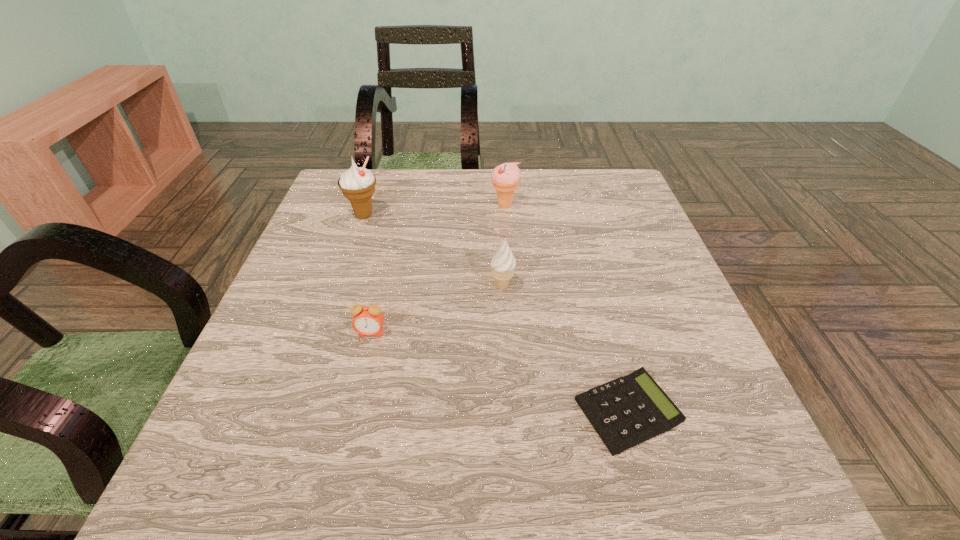
Where is `the tallest object`? The width and height of the screenshot is (960, 540). the tallest object is located at coordinates (357, 184).

The height and width of the screenshot is (540, 960). Find the location of `the leftmost object`. the leftmost object is located at coordinates (357, 184).

Where is `the nearest icecream`? This screenshot has height=540, width=960. the nearest icecream is located at coordinates (503, 263).

The height and width of the screenshot is (540, 960). I want to click on the second shortest object, so click(x=368, y=320).

The image size is (960, 540). What are the coordinates of `the second object from left to right` in the screenshot? It's located at (368, 320).

The height and width of the screenshot is (540, 960). Find the location of `the rightmost object`. the rightmost object is located at coordinates (627, 411).

The width and height of the screenshot is (960, 540). I want to click on calculator, so click(x=627, y=411).

Identify the location of vacant space located 0.190m on the front of the tallest object. Image resolution: width=960 pixels, height=540 pixels. (343, 278).

Image resolution: width=960 pixels, height=540 pixels. I want to click on free location located on the front-facing side of the nearest icecream, so click(403, 287).

The image size is (960, 540). What are the coordinates of `vacant area situated on the front-facing side of the nearest icecream` in the screenshot? It's located at (370, 287).